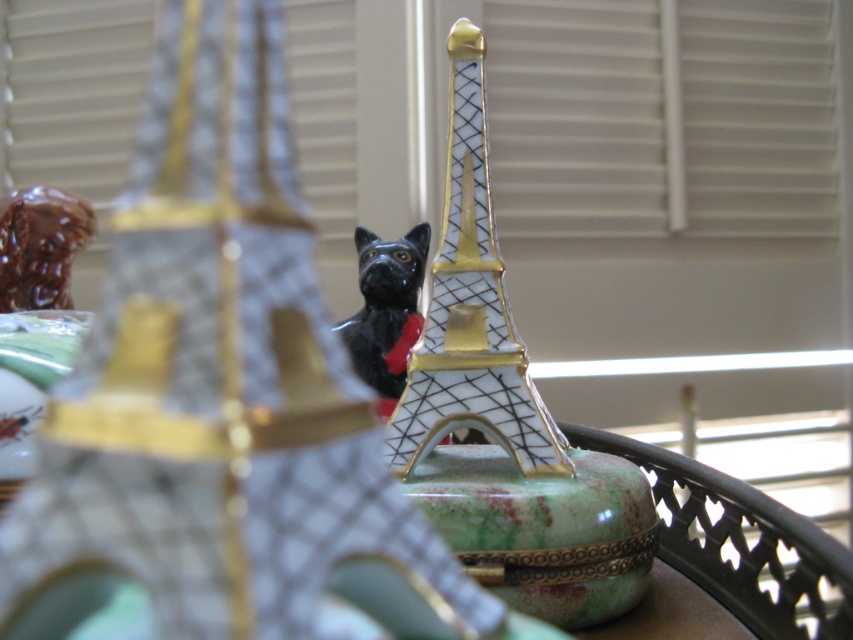
Consider the image. Does matte black cat at center come behind porcelain eiffel tower at center?

No, matte black cat at center is in front of porcelain eiffel tower at center.

Is matte black cat at center to the right of porcelain eiffel tower at center from the viewer's perspective?

No, matte black cat at center is not to the right of porcelain eiffel tower at center.

This screenshot has width=853, height=640. Identify the location of matte black cat at center. (221, 401).

Does matte black cat at center have a lesser height compared to black glossy cat at center?

Incorrect, matte black cat at center's height does not fall short of black glossy cat at center's.

Locate an element on the screen. matte black cat at center is located at coordinates (221, 401).

Is point (206, 182) closer to camera compared to point (418, 236)?

Yes, it is in front of point (418, 236).

In order to click on matte black cat at center in this screenshot , I will do `click(221, 401)`.

Where is `porcelain eiffel tower at center`? This screenshot has width=853, height=640. porcelain eiffel tower at center is located at coordinates (469, 308).

Is porcelain eiffel tower at center smaller than black glossy cat at center?

No.

Which is behind, point (422, 435) or point (390, 326)?

The point (390, 326) is more distant.

Locate an element on the screen. porcelain eiffel tower at center is located at coordinates (469, 308).